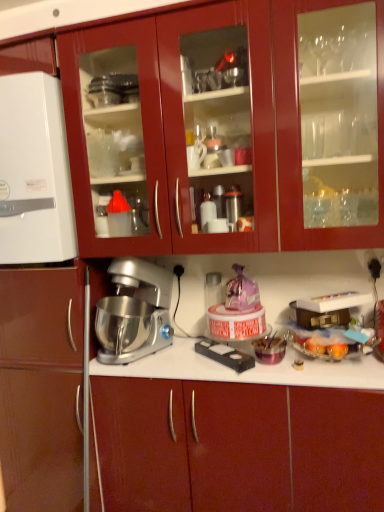
Question: Considering the relative sizes of matte red cabinet at center, the 1th cabinetry in the bottom-to-top sequence, and silver metallic stand mixer at center in the image provided, is matte red cabinet at center, the 1th cabinetry in the bottom-to-top sequence, smaller than silver metallic stand mixer at center?

Choices:
 (A) no
 (B) yes

Answer: (A)

Question: From a real-world perspective, is matte red cabinet at center, the 2th cabinetry positioned from the top, positioned over silver metallic stand mixer at center based on gravity?

Choices:
 (A) no
 (B) yes

Answer: (A)

Question: From a real-world perspective, is matte red cabinet at center, the 1th cabinetry in the bottom-to-top sequence, located beneath silver metallic stand mixer at center?

Choices:
 (A) no
 (B) yes

Answer: (B)

Question: From the image's perspective, would you say matte red cabinet at center, the 1th cabinetry in the bottom-to-top sequence, is shown under silver metallic stand mixer at center?

Choices:
 (A) no
 (B) yes

Answer: (B)

Question: From the image's perspective, does matte red cabinet at center, the 2th cabinetry positioned from the top, appear higher than silver metallic stand mixer at center?

Choices:
 (A) no
 (B) yes

Answer: (A)

Question: Would you say silver metallic stand mixer at center is to the left or to the right of white matte refrigerator at left, which is counted as the 1th appliance, starting from the top, in the picture?

Choices:
 (A) right
 (B) left

Answer: (A)

Question: In the image, is silver metallic stand mixer at center positioned in front of or behind white matte refrigerator at left, which is the 2th appliance from bottom to top?

Choices:
 (A) front
 (B) behind

Answer: (A)

Question: From a real-world perspective, is silver metallic stand mixer at center above or below white matte refrigerator at left, which is the 2th appliance from bottom to top?

Choices:
 (A) above
 (B) below

Answer: (B)

Question: Is point (135, 270) closer or farther from the camera than point (56, 240)?

Choices:
 (A) closer
 (B) farther

Answer: (B)

Question: Considering the positions of matte red cabinet at center, the 2th cabinetry positioned from the top, and white matte refrigerator at left, marked as the second appliance in a right-to-left arrangement, in the image, is matte red cabinet at center, the 2th cabinetry positioned from the top, wider or thinner than white matte refrigerator at left, marked as the second appliance in a right-to-left arrangement,?

Choices:
 (A) thin
 (B) wide

Answer: (B)

Question: Is point (187, 470) positioned closer to the camera than point (56, 154)?

Choices:
 (A) closer
 (B) farther

Answer: (B)

Question: In the image, is matte red cabinet at center, the 2th cabinetry positioned from the top, positioned in front of or behind white matte refrigerator at left, the 1th appliance viewed from the left?

Choices:
 (A) front
 (B) behind

Answer: (A)

Question: Which is correct: matte red cabinet at center, the 1th cabinetry in the bottom-to-top sequence, is inside white matte refrigerator at left, which is counted as the 1th appliance, starting from the top, or outside of it?

Choices:
 (A) inside
 (B) outside

Answer: (B)

Question: Would you say matte red cabinet at center, the 2th cabinetry positioned from the top, is to the left or to the right of glossy wood cabinets at upper center, arranged as the 2th cabinetry when ordered from the bottom, in the picture?

Choices:
 (A) right
 (B) left

Answer: (A)

Question: Considering their positions, is matte red cabinet at center, the 1th cabinetry in the bottom-to-top sequence, located in front of or behind glossy wood cabinets at upper center, arranged as the 2th cabinetry when ordered from the bottom?

Choices:
 (A) front
 (B) behind

Answer: (B)